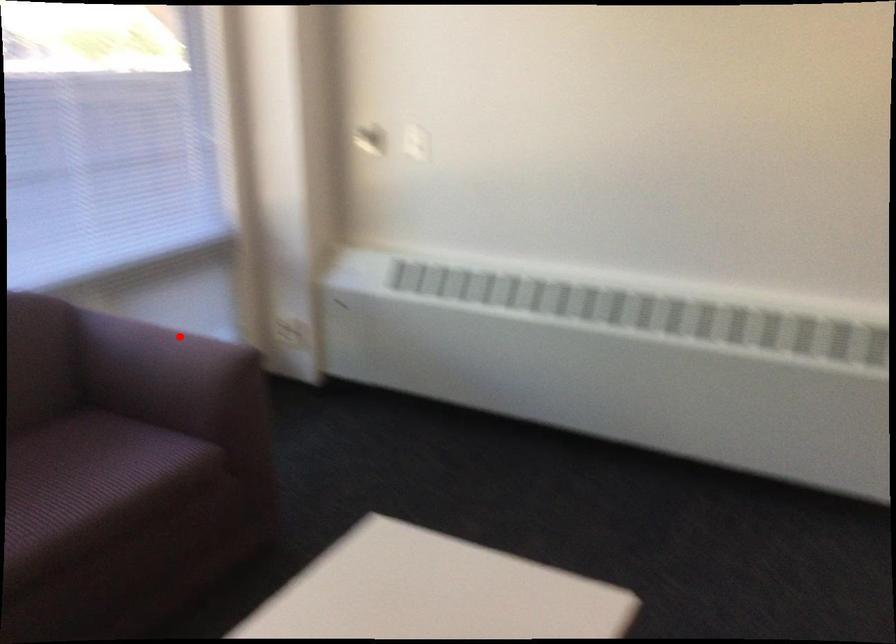
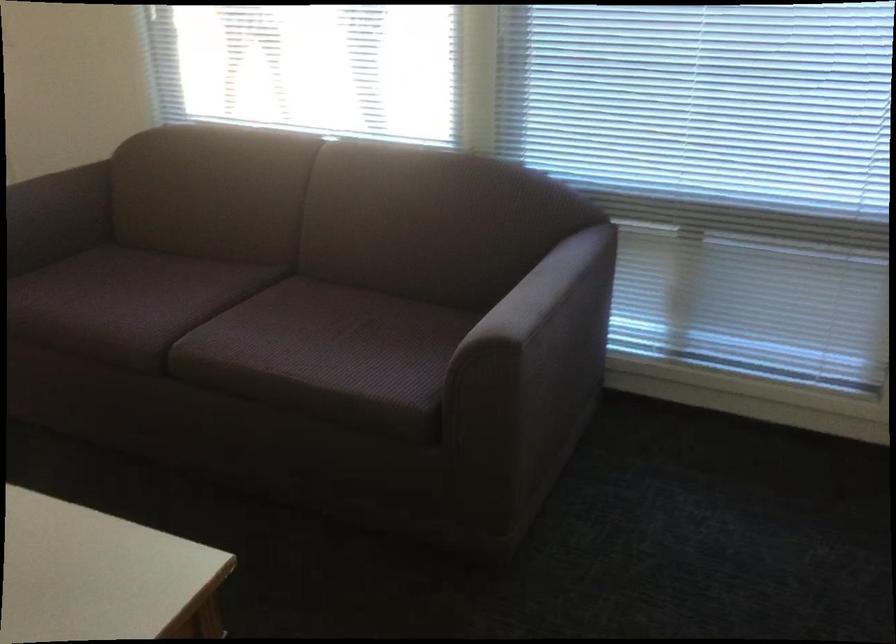
Question: I am providing you with two images of the same scene from different viewpoints. A red point is shown in image1. For the corresponding object point in image2, is it positioned nearer or farther from the camera?

Choices:
 (A) Nearer
 (B) Farther

Answer: (A)